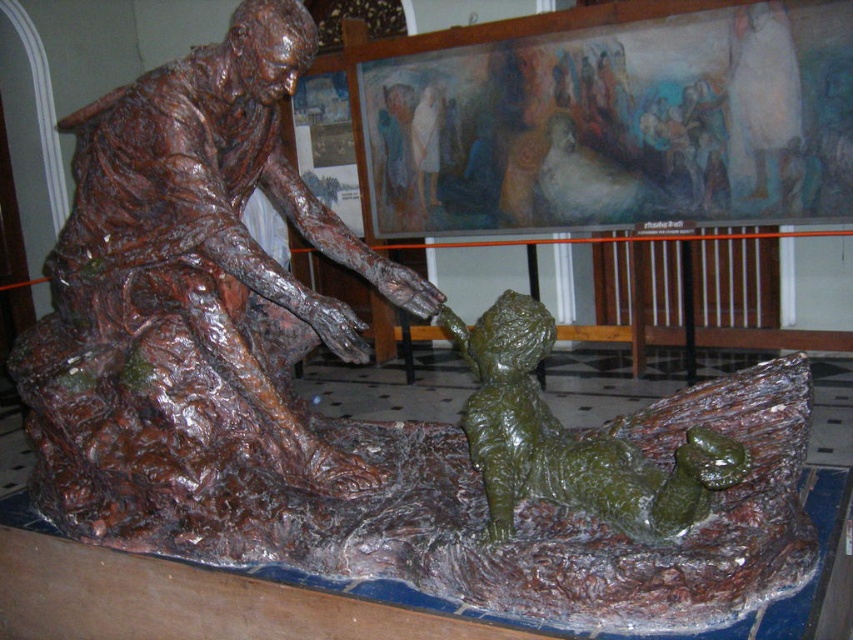
Is point (148, 122) positioned before point (698, 492)?

No.

Which is below, bronze statue at center or green wax boy at center?

green wax boy at center is lower down.

Which is behind, point (245, 320) or point (485, 444)?

Positioned behind is point (245, 320).

You are a GUI agent. You are given a task and a screenshot of the screen. Output one action in this format:
    pyautogui.click(x=<x>, y=<y>)
    Task: Click on the bronze statue at center
    This screenshot has width=853, height=640.
    Given the screenshot: What is the action you would take?
    pyautogui.click(x=194, y=316)